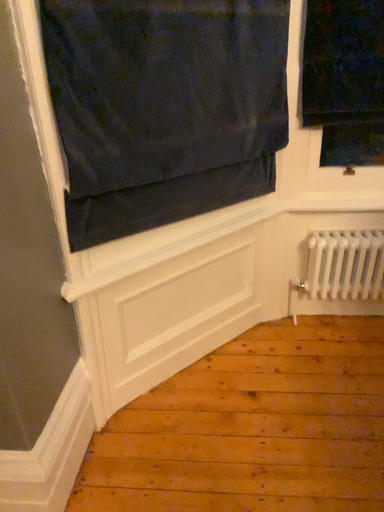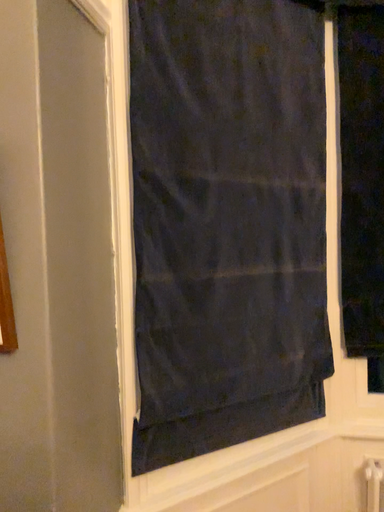
Question: Which way did the camera rotate in the video?

Choices:
 (A) rotated downward
 (B) rotated upward

Answer: (B)